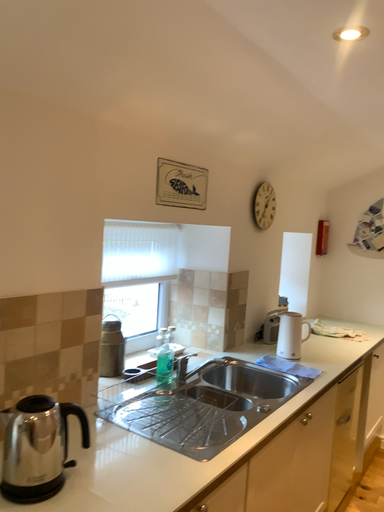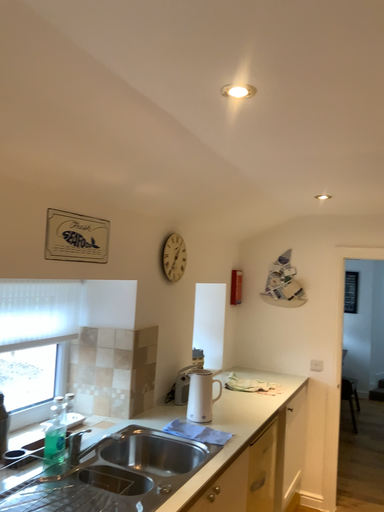
Question: How did the camera likely rotate when shooting the video?

Choices:
 (A) rotated left
 (B) rotated right

Answer: (B)